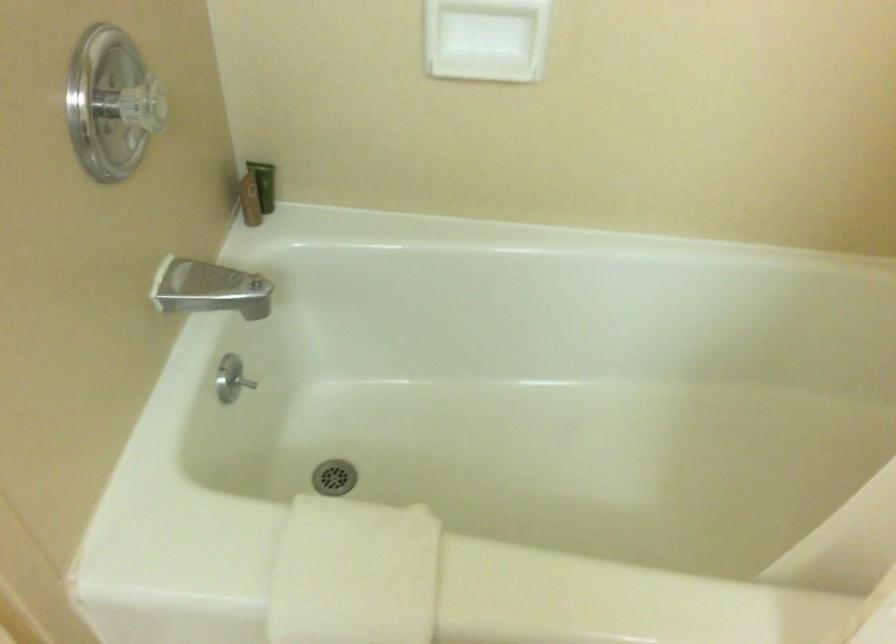
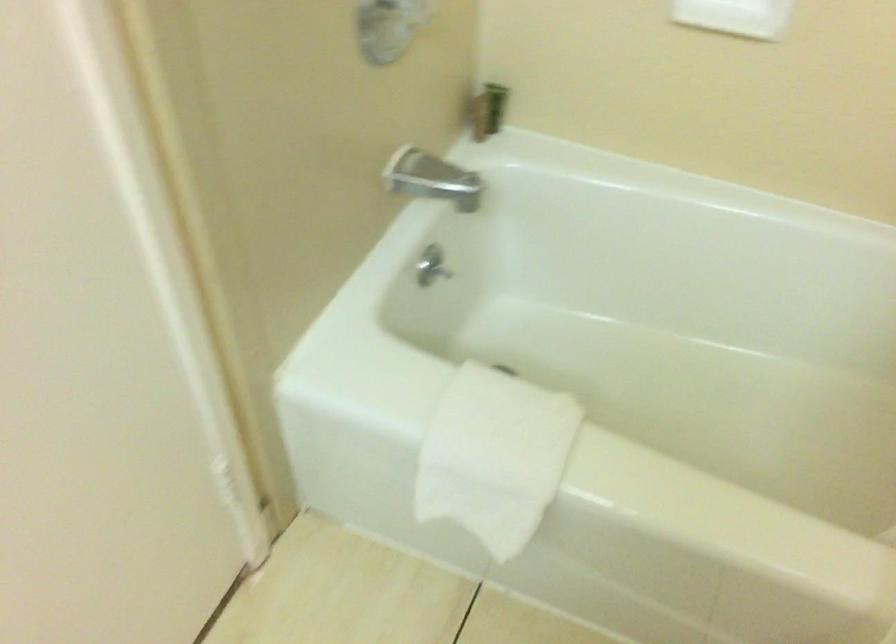
Question: The images are taken continuously from a first-person perspective. In which direction are you moving?

Choices:
 (A) Left
 (B) Right
 (C) Forward
 (D) Backward

Answer: (D)